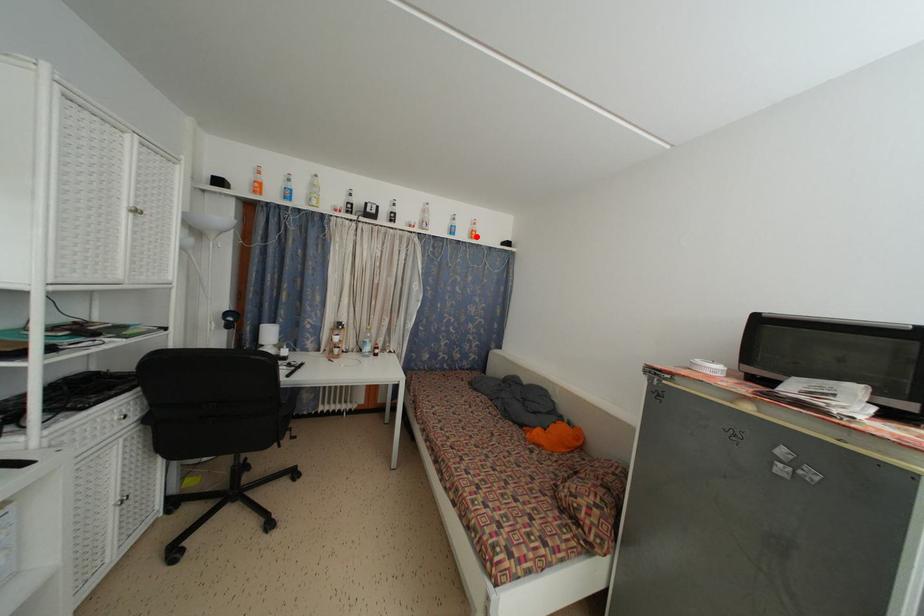
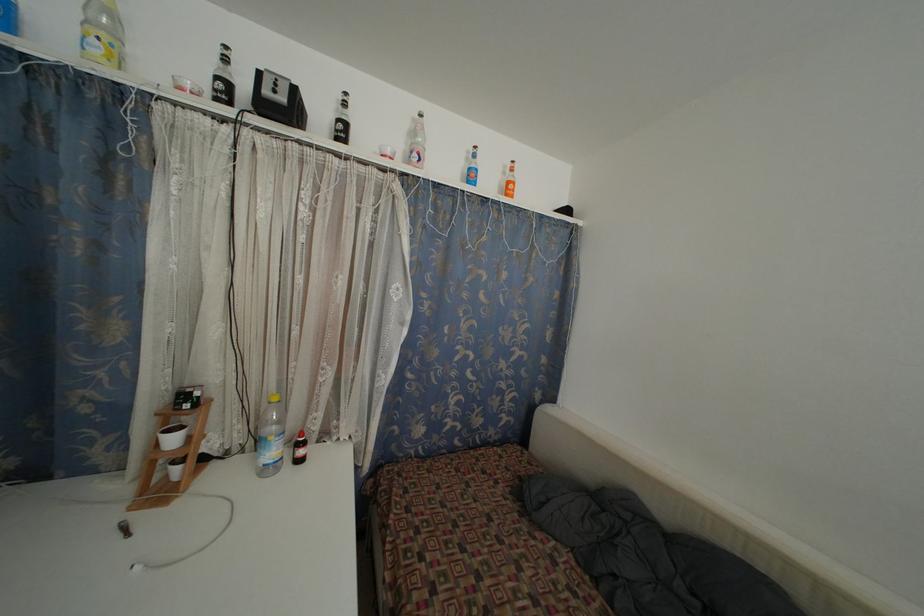
In the second image, find the point that corresponds to the highlighted location in the first image.

(513, 188)